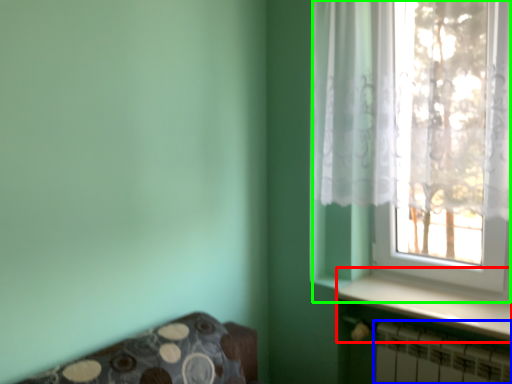
Question: Considering the real-world distances, which object is farthest from window sill (highlighted by a red box)? radiator (highlighted by a blue box) or window (highlighted by a green box)?

Choices:
 (A) radiator
 (B) window

Answer: (B)